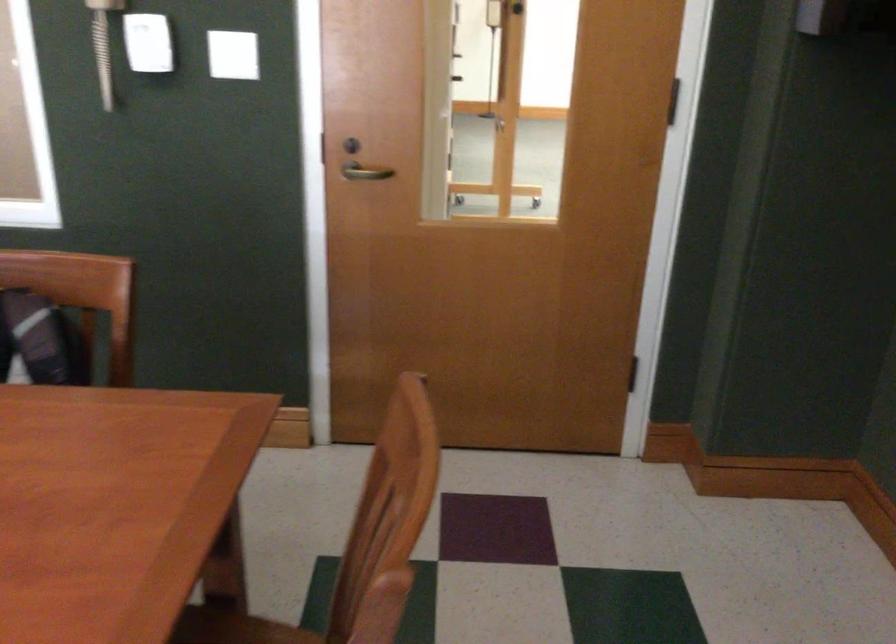
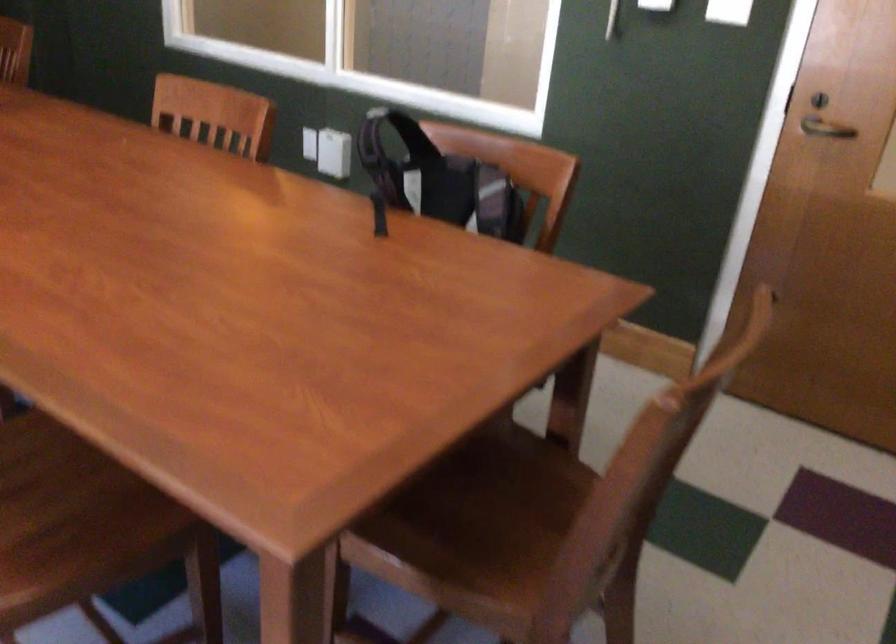
In the second image, find the point that corresponds to the point at 357,176 in the first image.

(824, 129)